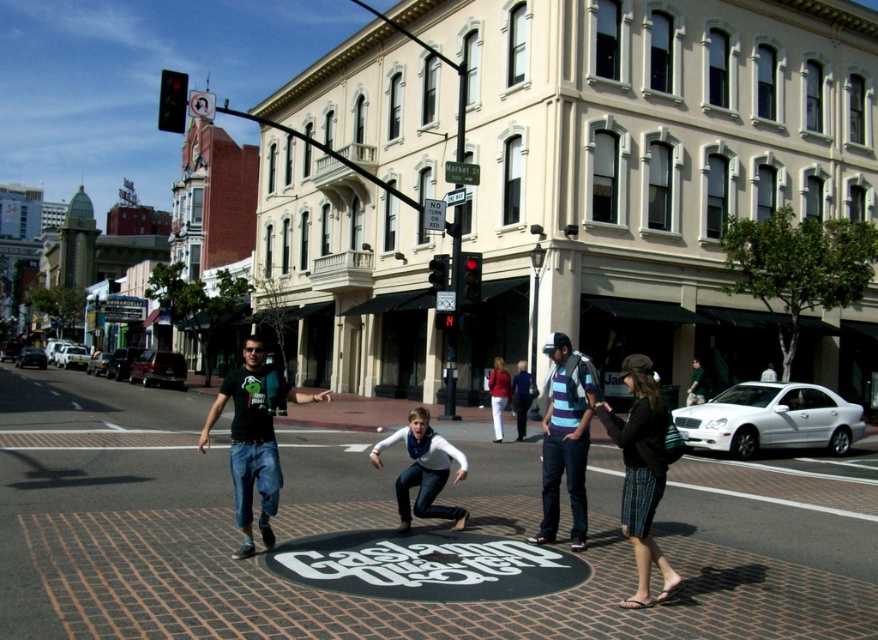
You are standing at the Gaslamp Quarter pedestrian crossing and want to take a photo of the two points mentioned. Which point, point (613,416) or point (272,380), will appear larger in your camera view?

Point (613,416) will appear larger in the camera view because it is closer to the viewer than point (272,380).